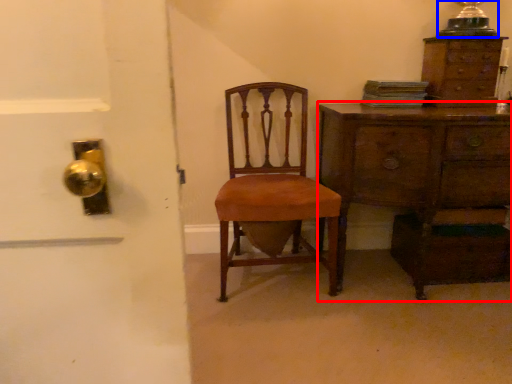
Question: Which point is further to the camera, chest of drawers (highlighted by a red box) or table lamp (highlighted by a blue box)?

Choices:
 (A) chest of drawers
 (B) table lamp

Answer: (B)